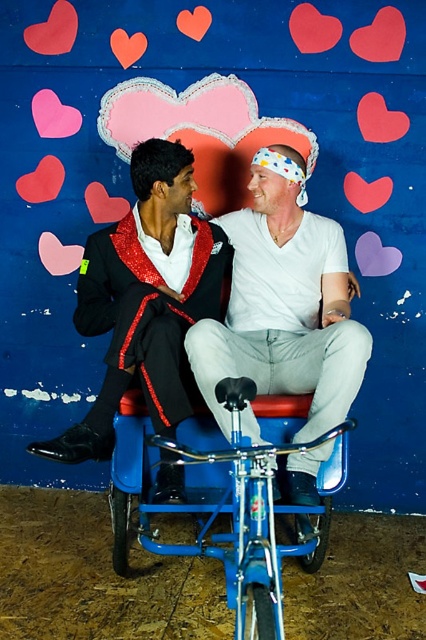
You are a photographer setting up for a photo shoot. You need to ensure that the shiny sequined suit at center and the blue metallic bicycle at center are both visible in the frame. Based on their positions, which object is covering part of the other?

The shiny sequined suit at center is positioned over the blue metallic bicycle at center, so the sequined suit is covering part of the bicycle.

You are a photographer setting up for a photo shoot. You want to ensure that the shiny sequined suit at center and the blue metallic bicycle at center are positioned so that there is enough space between them for a lighting setup. The lighting equipment requires at least 40 centimeters of space. Based on the scene description, can you confirm if there is sufficient space between the two objects?

The shiny sequined suit at center and the blue metallic bicycle at center are 39.68 centimeters apart. Since the required space is 40 centimeters, there is not enough space for the lighting setup.